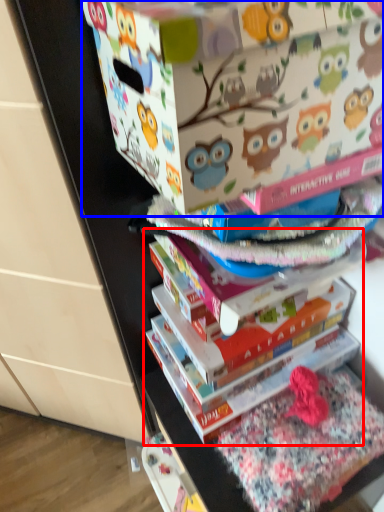
Question: Which of the following is the farthest to the observer, book (highlighted by a red box) or cardboard box (highlighted by a blue box)?

Choices:
 (A) book
 (B) cardboard box

Answer: (A)